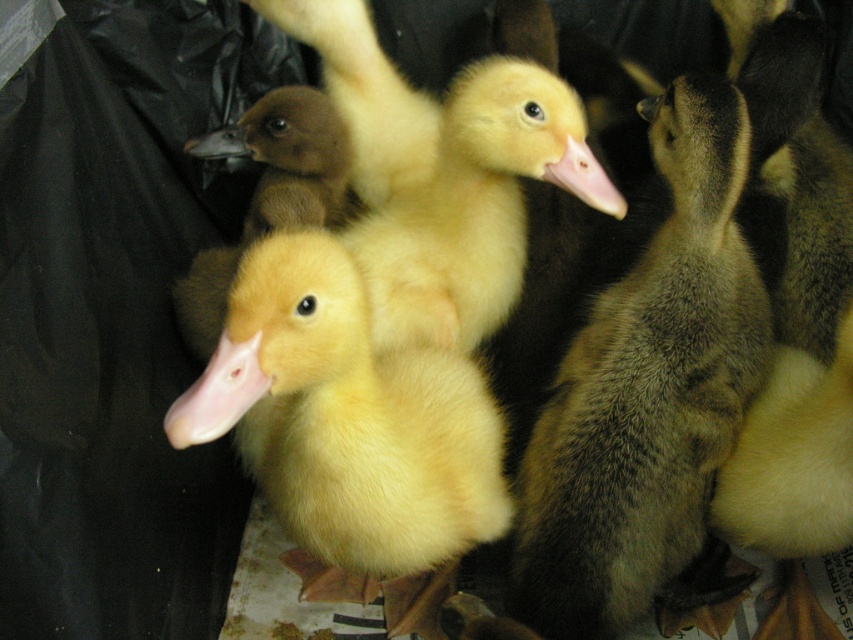
You are observing a group of baby ducks in a pen. You notice two ducklings at the center of the image, a soft yellow duckling at center and a yellow fluffy duckling at center. Which one is positioned to the right?

The soft yellow duckling at center is positioned to the right of the yellow fluffy duckling at center.

You are observing baby ducks in a pen. You notice two points marked in the image. The first point is at coordinate point (643, 364) and the second is at point (302, 460). From your perspective, which point is closer to you?

Point (302, 460) is closer to you since point (643, 364) is behind it.